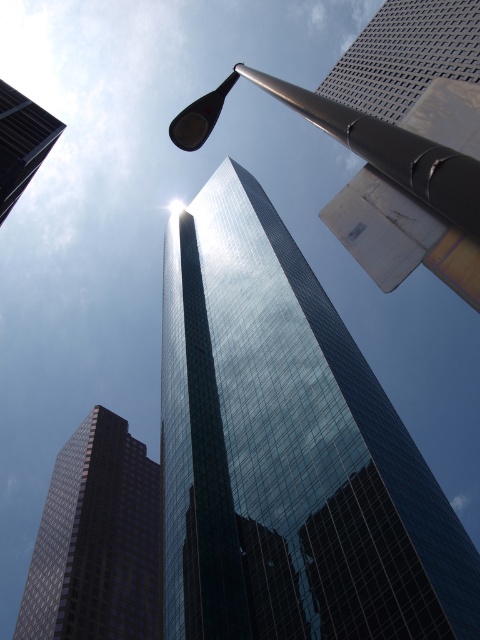
Question: Which point is farther to the camera?

Choices:
 (A) (63, 124)
 (B) (422, 232)
 (C) (29, 589)

Answer: (A)

Question: Can you confirm if metallic grid-patterned skyscraper at upper center is positioned above glassy reflective skyscraper at upper left?

Choices:
 (A) yes
 (B) no

Answer: (A)

Question: Does dark glass skyscraper at center appear on the left side of glassy reflective skyscraper at upper left?

Choices:
 (A) no
 (B) yes

Answer: (B)

Question: Which of the following is the closest to the observer?

Choices:
 (A) metallic grid-patterned skyscraper at upper center
 (B) glossy glass tower at center

Answer: (A)

Question: Is metallic grid-patterned skyscraper at upper center to the left of glassy reflective skyscraper at upper left from the viewer's perspective?

Choices:
 (A) yes
 (B) no

Answer: (B)

Question: Which object is the farthest from the glassy reflective skyscraper at upper left?

Choices:
 (A) glossy glass tower at center
 (B) metallic grid-patterned skyscraper at upper center
 (C) polished metal pole at upper center
 (D) dark glass skyscraper at center

Answer: (D)